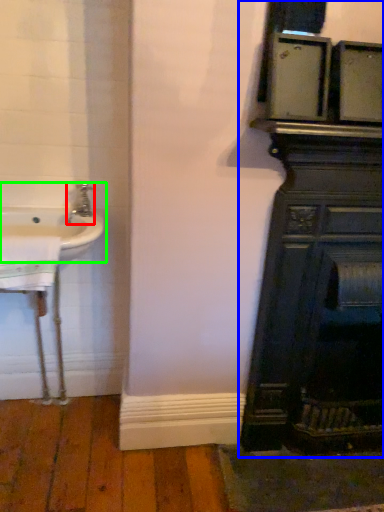
Question: Which object is the closest to the tap (highlighted by a red box)? Choose among these: bathroom cabinet (highlighted by a blue box) or sink (highlighted by a green box).

Choices:
 (A) bathroom cabinet
 (B) sink

Answer: (B)